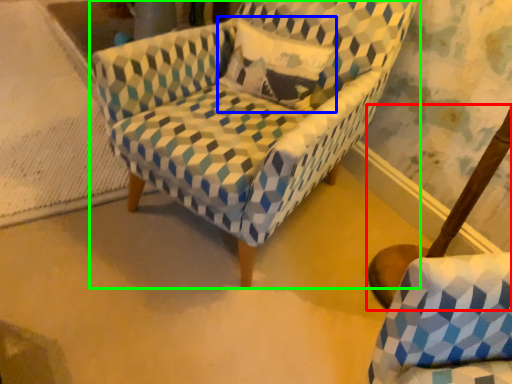
Question: Which object is the closest to the swivel chair (highlighted by a red box)? Choose among these: throw pillow (highlighted by a blue box) or chair (highlighted by a green box).

Choices:
 (A) throw pillow
 (B) chair

Answer: (B)